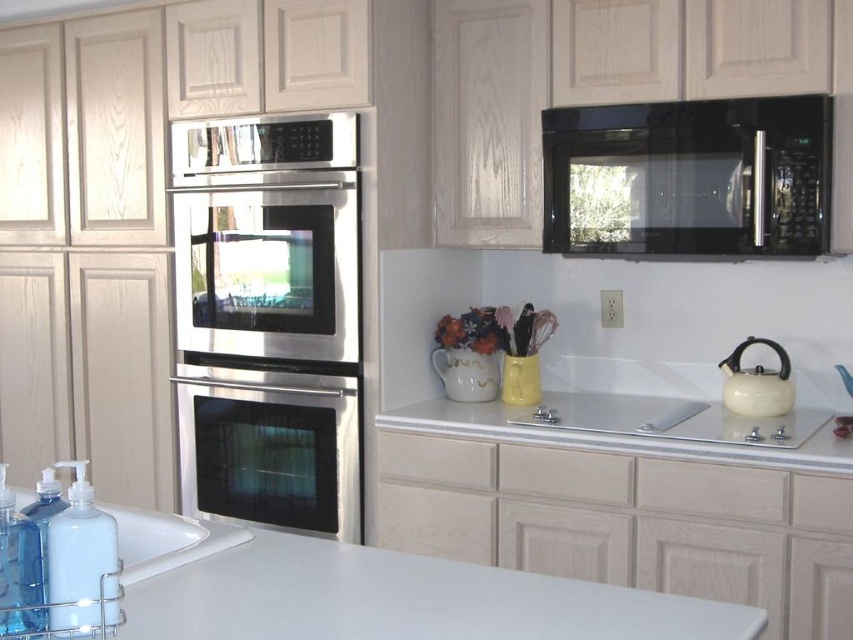
At what (x,y) coordinates should I click in order to perform the action: click on white matte countertop at center. Please return your answer as a coordinate pair (x, y). Looking at the image, I should click on (392, 596).

Is point (515, 596) farther from camera compared to point (32, 579)?

Yes, point (515, 596) is behind point (32, 579).

The height and width of the screenshot is (640, 853). In order to click on white matte countertop at center in this screenshot , I will do click(392, 596).

Between point (238, 326) and point (828, 112), which one is positioned in front?

Point (828, 112) is in front.

Is stainless steel oven at center wider than black glass microwave at upper right?

In fact, stainless steel oven at center might be narrower than black glass microwave at upper right.

Between point (204, 468) and point (757, 244), which one is positioned in front?

Point (757, 244) is more forward.

Identify the location of stainless steel oven at center. The height and width of the screenshot is (640, 853). (270, 321).

Consider the image. Which is above, white matte countertop at center or black glass microwave at upper right?

Positioned higher is black glass microwave at upper right.

Who is positioned more to the right, white matte countertop at center or black glass microwave at upper right?

Positioned to the right is black glass microwave at upper right.

Who is more distant from viewer, (466, 611) or (756, 252)?

The point (756, 252) is behind.

This screenshot has width=853, height=640. Find the location of `white matte countertop at center`. white matte countertop at center is located at coordinates (392, 596).